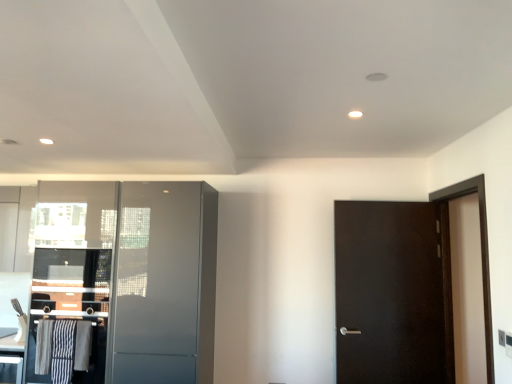
Question: Can you confirm if dark wood screen door at right, which is the 2th screen door from left to right, is positioned to the left of striped fabric laundry at lower left?

Choices:
 (A) yes
 (B) no

Answer: (B)

Question: Would you say dark wood screen door at right, which is the 2th screen door from left to right, contains striped fabric laundry at lower left?

Choices:
 (A) no
 (B) yes

Answer: (A)

Question: Can you confirm if dark wood screen door at right, which is the 2th screen door from left to right, is thinner than striped fabric laundry at lower left?

Choices:
 (A) no
 (B) yes

Answer: (A)

Question: Is dark wood screen door at right, acting as the 1th screen door starting from the right, bigger than striped fabric laundry at lower left?

Choices:
 (A) yes
 (B) no

Answer: (A)

Question: Is the depth of dark wood screen door at right, acting as the 1th screen door starting from the right, less than that of striped fabric laundry at lower left?

Choices:
 (A) no
 (B) yes

Answer: (B)

Question: Considering their positions, is metallic silver cabinet at left, the 2th cabinetry positioned from the top, located in front of or behind satin gray cabinet at left, the first screen door in the left-to-right sequence?

Choices:
 (A) front
 (B) behind

Answer: (B)

Question: In terms of width, does metallic silver cabinet at left, which is the 1th cabinetry in bottom-to-top order, look wider or thinner when compared to satin gray cabinet at left, the first screen door in the left-to-right sequence?

Choices:
 (A) thin
 (B) wide

Answer: (A)

Question: From the image's perspective, is metallic silver cabinet at left, which is the 1th cabinetry in bottom-to-top order, above or below satin gray cabinet at left, which is counted as the second screen door, starting from the right?

Choices:
 (A) above
 (B) below

Answer: (B)

Question: From a real-world perspective, is metallic silver cabinet at left, the 2th cabinetry positioned from the top, physically located above or below satin gray cabinet at left, the first screen door in the left-to-right sequence?

Choices:
 (A) above
 (B) below

Answer: (B)

Question: Considering their positions, is striped fabric laundry at lower left located in front of or behind satin gray cabinet at left, which is counted as the second screen door, starting from the right?

Choices:
 (A) front
 (B) behind

Answer: (B)

Question: Is point (47, 342) closer or farther from the camera than point (187, 203)?

Choices:
 (A) closer
 (B) farther

Answer: (A)

Question: Considering the positions of striped fabric laundry at lower left and satin gray cabinet at left, which is counted as the second screen door, starting from the right, in the image, is striped fabric laundry at lower left taller or shorter than satin gray cabinet at left, which is counted as the second screen door, starting from the right,?

Choices:
 (A) short
 (B) tall

Answer: (A)

Question: In terms of width, does striped fabric laundry at lower left look wider or thinner when compared to satin gray cabinet at left, which is counted as the second screen door, starting from the right?

Choices:
 (A) wide
 (B) thin

Answer: (B)

Question: In the image, is striped fabric laundry at lower left on the left side or the right side of metallic silver cabinet at left, the 2th cabinetry positioned from the top?

Choices:
 (A) left
 (B) right

Answer: (A)

Question: Considering the positions of striped fabric laundry at lower left and metallic silver cabinet at left, the 2th cabinetry positioned from the top, in the image, is striped fabric laundry at lower left taller or shorter than metallic silver cabinet at left, the 2th cabinetry positioned from the top,?

Choices:
 (A) tall
 (B) short

Answer: (B)